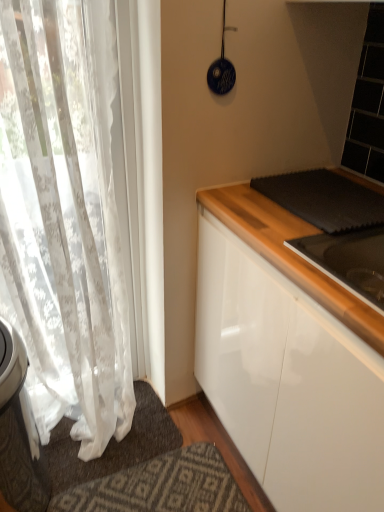
Measure the distance between point (x=57, y=454) and camera.

5.09 feet.

What do you see at coordinates (113, 444) in the screenshot?
I see `white fabric doormat at lower left` at bounding box center [113, 444].

Identify the location of white fabric doormat at lower left. (113, 444).

What do you see at coordinates (64, 215) in the screenshot? I see `white lace curtain at left` at bounding box center [64, 215].

Find the location of a particular element. The height and width of the screenshot is (512, 384). white lace curtain at left is located at coordinates (64, 215).

Where is `white fabric doormat at lower left`? white fabric doormat at lower left is located at coordinates (113, 444).

Which is more to the right, white lace curtain at left or white fabric doormat at lower left?

white fabric doormat at lower left.

Considering the positions of objects white lace curtain at left and white fabric doormat at lower left in the image provided, who is in front, white lace curtain at left or white fabric doormat at lower left?

white lace curtain at left is closer to the camera.

Is point (39, 339) closer to viewer compared to point (114, 472)?

Yes.

From the image's perspective, is white lace curtain at left under white fabric doormat at lower left?

No, from the image's perspective, white lace curtain at left is not below white fabric doormat at lower left.

From a real-world perspective, is white lace curtain at left located higher than white fabric doormat at lower left?

Indeed, from a real-world perspective, white lace curtain at left stands above white fabric doormat at lower left.

Between white lace curtain at left and white fabric doormat at lower left, which one has smaller width?

With smaller width is white lace curtain at left.

In terms of height, does white lace curtain at left look taller or shorter compared to white fabric doormat at lower left?

Considering their sizes, white lace curtain at left has more height than white fabric doormat at lower left.

Between white lace curtain at left and white fabric doormat at lower left, which one has larger size?

white lace curtain at left.

Is white lace curtain at left not inside white fabric doormat at lower left?

That's correct, white lace curtain at left is outside of white fabric doormat at lower left.

Is there a large distance between white lace curtain at left and white fabric doormat at lower left?

Actually, white lace curtain at left and white fabric doormat at lower left are a little close together.

Is white lace curtain at left facing towards white fabric doormat at lower left?

Yes, white lace curtain at left is aimed at white fabric doormat at lower left.

What's the angular difference between white lace curtain at left and white fabric doormat at lower left's facing directions?

The angular difference between white lace curtain at left and white fabric doormat at lower left is 1.82 degrees.

The height and width of the screenshot is (512, 384). What are the coordinates of `curtain in front of the white fabric doormat at lower left` in the screenshot? It's located at (64, 215).

Is white fabric doormat at lower left at the right side of white lace curtain at left?

Indeed, white fabric doormat at lower left is positioned on the right side of white lace curtain at left.

Is white fabric doormat at lower left closer to the viewer compared to white lace curtain at left?

No, white fabric doormat at lower left is further to the viewer.

Is point (60, 446) closer or farther from the camera than point (99, 378)?

Clearly, point (60, 446) is more distant from the camera than point (99, 378).

Based on the photo, from the image's perspective, which is below, white fabric doormat at lower left or white lace curtain at left?

white fabric doormat at lower left.

From a real-world perspective, is white fabric doormat at lower left under white lace curtain at left?

Yes, from a real-world perspective, white fabric doormat at lower left is below white lace curtain at left.

Considering the relative sizes of white fabric doormat at lower left and white lace curtain at left in the image provided, is white fabric doormat at lower left wider than white lace curtain at left?

Yes, white fabric doormat at lower left is wider than white lace curtain at left.

Who is shorter, white fabric doormat at lower left or white lace curtain at left?

With less height is white fabric doormat at lower left.

Who is bigger, white fabric doormat at lower left or white lace curtain at left?

white lace curtain at left is bigger.

Is white fabric doormat at lower left not within white lace curtain at left?

Yes.

Is white fabric doormat at lower left positioned far away from white lace curtain at left?

No, white fabric doormat at lower left is not far away from white lace curtain at left.

Is white lace curtain at left at the back of white fabric doormat at lower left?

That's not correct — white fabric doormat at lower left is not looking away from white lace curtain at left.

What's the angular difference between white fabric doormat at lower left and white lace curtain at left's facing directions?

1.82 degrees separate the facing orientations of white fabric doormat at lower left and white lace curtain at left.

Measure the distance between white fabric doormat at lower left and white lace curtain at left.

19.16 inches.

Identify the location of doormat that is behind the white lace curtain at left. The image size is (384, 512). (113, 444).

This screenshot has height=512, width=384. In order to click on curtain located above the white fabric doormat at lower left (from a real-world perspective) in this screenshot , I will do `click(64, 215)`.

This screenshot has width=384, height=512. Find the location of `doormat behind the white lace curtain at left`. doormat behind the white lace curtain at left is located at coordinates (113, 444).